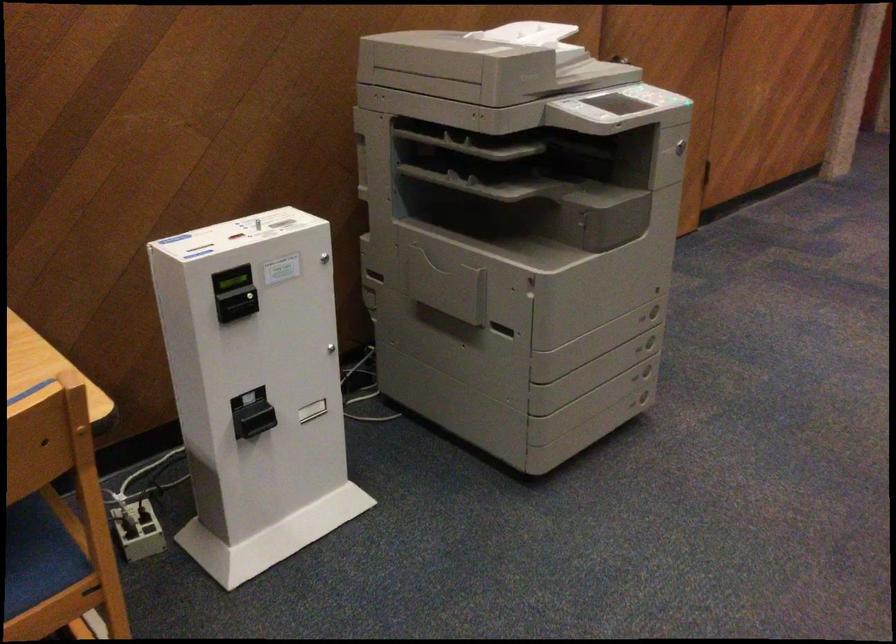
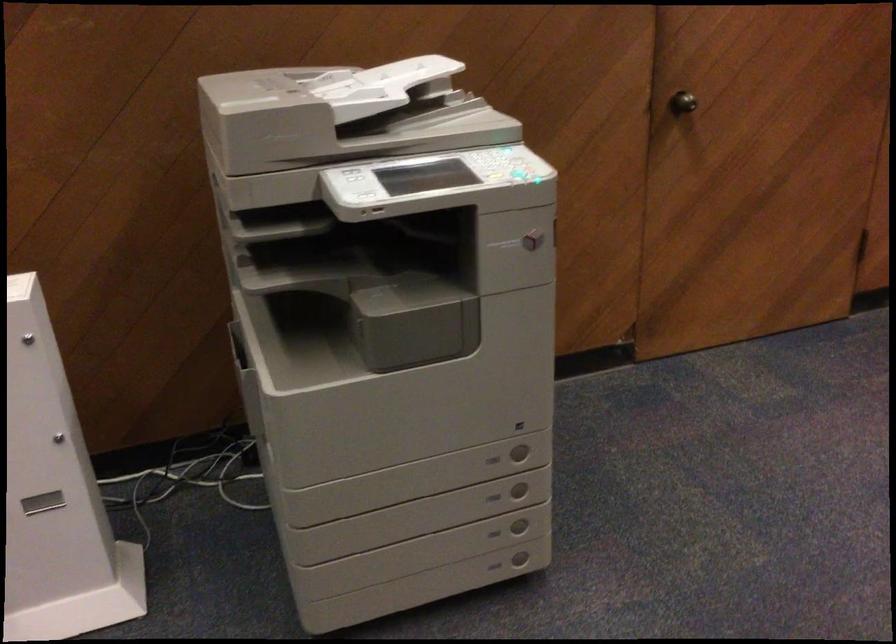
Find the pixel in the second image that matches the point at 633,406 in the first image.

(494, 567)